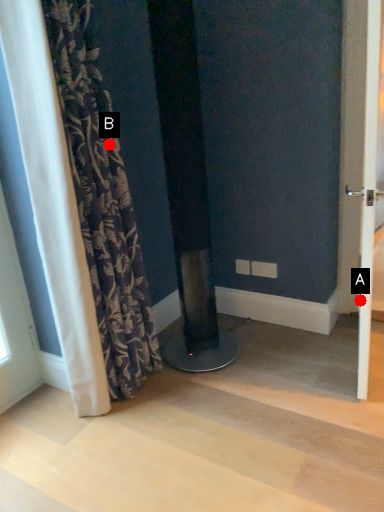
Question: Two points are circled on the image, labeled by A and B beside each circle. Which of the following is the closest to the observer?

Choices:
 (A) A is closer
 (B) B is closer

Answer: (B)